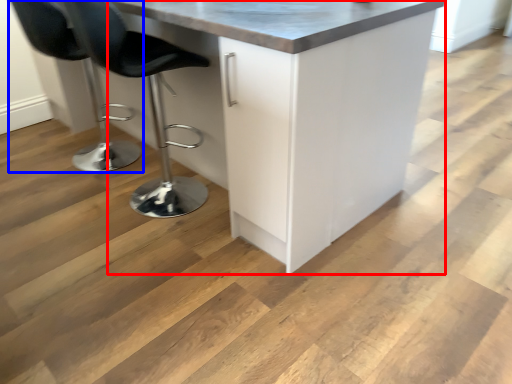
Question: Which object is closer to the camera taking this photo, cabinetry (highlighted by a red box) or chair (highlighted by a blue box)?

Choices:
 (A) cabinetry
 (B) chair

Answer: (A)